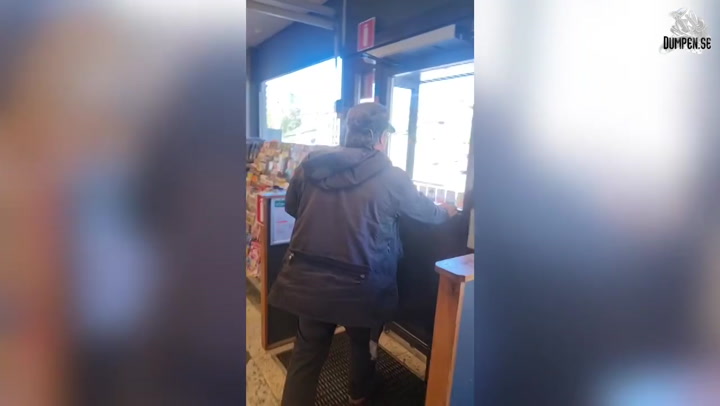
Find the location of `rug/mat`. rug/mat is located at coordinates (392, 381).